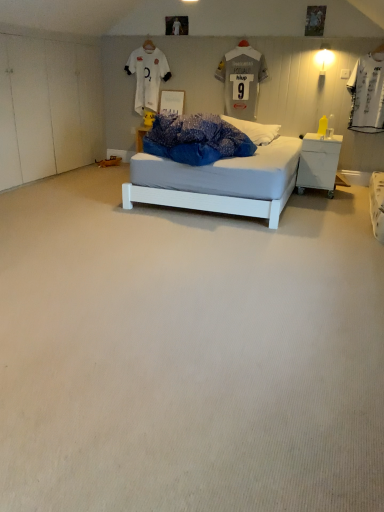
Question: Can you confirm if white plastic nightstand at right is wider than gray fabric jersey at upper center, which ranks as the second t shirt in left-to-right order?

Choices:
 (A) no
 (B) yes

Answer: (B)

Question: From the image's perspective, would you say white plastic nightstand at right is positioned over gray fabric jersey at upper center, which ranks as the second t shirt in left-to-right order?

Choices:
 (A) no
 (B) yes

Answer: (A)

Question: Can you confirm if white plastic nightstand at right is thinner than gray fabric jersey at upper center, the first t shirt from the right?

Choices:
 (A) no
 (B) yes

Answer: (A)

Question: Is white plastic nightstand at right at the left side of gray fabric jersey at upper center, the first t shirt from the right?

Choices:
 (A) yes
 (B) no

Answer: (B)

Question: Is the depth of white plastic nightstand at right less than that of gray fabric jersey at upper center, which ranks as the second t shirt in left-to-right order?

Choices:
 (A) no
 (B) yes

Answer: (B)

Question: From the image's perspective, is white carpet at center located above or below white plastic nightstand at right?

Choices:
 (A) below
 (B) above

Answer: (A)

Question: Looking at their shapes, would you say white carpet at center is wider or thinner than white plastic nightstand at right?

Choices:
 (A) wide
 (B) thin

Answer: (A)

Question: Does point (112, 325) appear closer or farther from the camera than point (337, 165)?

Choices:
 (A) closer
 (B) farther

Answer: (A)

Question: Is white carpet at center in front of or behind white plastic nightstand at right in the image?

Choices:
 (A) front
 (B) behind

Answer: (A)

Question: Visually, is gray fabric jersey at upper center, which ranks as the second t shirt in left-to-right order, positioned to the left or to the right of white jersey at upper center, placed as the second t shirt when sorted from right to left?

Choices:
 (A) left
 (B) right

Answer: (B)

Question: Considering the positions of gray fabric jersey at upper center, the first t shirt from the right, and white jersey at upper center, placed as the second t shirt when sorted from right to left, in the image, is gray fabric jersey at upper center, the first t shirt from the right, taller or shorter than white jersey at upper center, placed as the second t shirt when sorted from right to left,?

Choices:
 (A) short
 (B) tall

Answer: (A)

Question: Would you say gray fabric jersey at upper center, the first t shirt from the right, is inside or outside white jersey at upper center, which is the 1th t shirt in left-to-right order?

Choices:
 (A) inside
 (B) outside

Answer: (B)

Question: Is point (258, 72) closer or farther from the camera than point (150, 46)?

Choices:
 (A) closer
 (B) farther

Answer: (A)

Question: Is gray fabric jersey at upper center, which ranks as the second t shirt in left-to-right order, taller or shorter than white carpet at center?

Choices:
 (A) short
 (B) tall

Answer: (B)

Question: Is gray fabric jersey at upper center, which ranks as the second t shirt in left-to-right order, in front of or behind white carpet at center in the image?

Choices:
 (A) front
 (B) behind

Answer: (B)